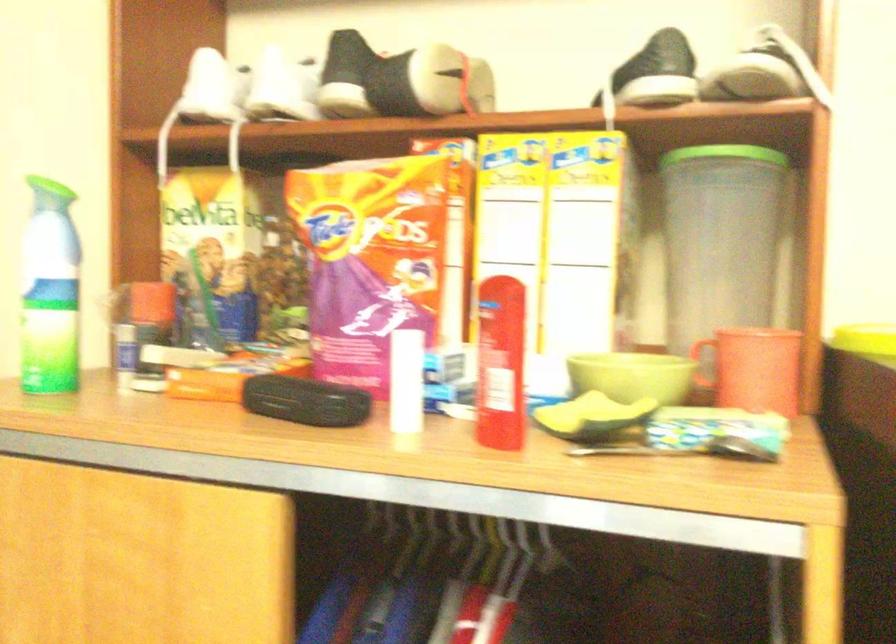
Locate an element on the screen. This screenshot has width=896, height=644. red plastic bottle is located at coordinates (501, 364).